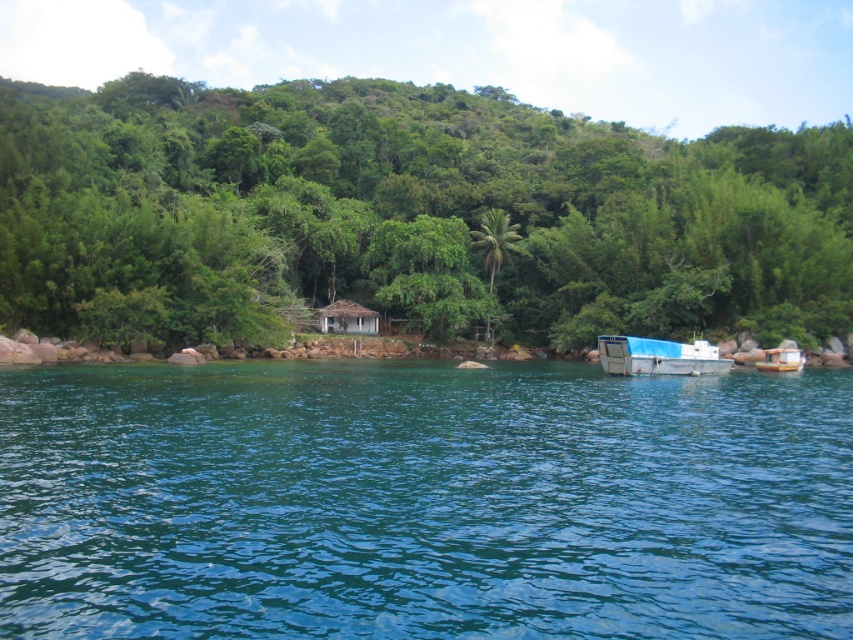
Question: Does white matte boat at lower right have a lesser width compared to white plastic boat at lower right?

Choices:
 (A) yes
 (B) no

Answer: (B)

Question: Does clear blue water at center appear over white plastic boat at lower right?

Choices:
 (A) yes
 (B) no

Answer: (B)

Question: Which object is the farthest from the brown thatched hut at center?

Choices:
 (A) white matte boat at lower right
 (B) clear blue water at center
 (C) white plastic boat at lower right
 (D) green leafy tree at center

Answer: (D)

Question: Among these points, which one is nearest to the camera?

Choices:
 (A) coord(128,102)
 (B) coord(773,371)
 (C) coord(306,588)

Answer: (C)

Question: Does brown thatched hut at center have a larger size compared to white plastic boat at lower right?

Choices:
 (A) no
 (B) yes

Answer: (A)

Question: Which point appears farthest from the camera in this image?

Choices:
 (A) (692, 369)
 (B) (57, 436)
 (C) (334, 307)

Answer: (C)